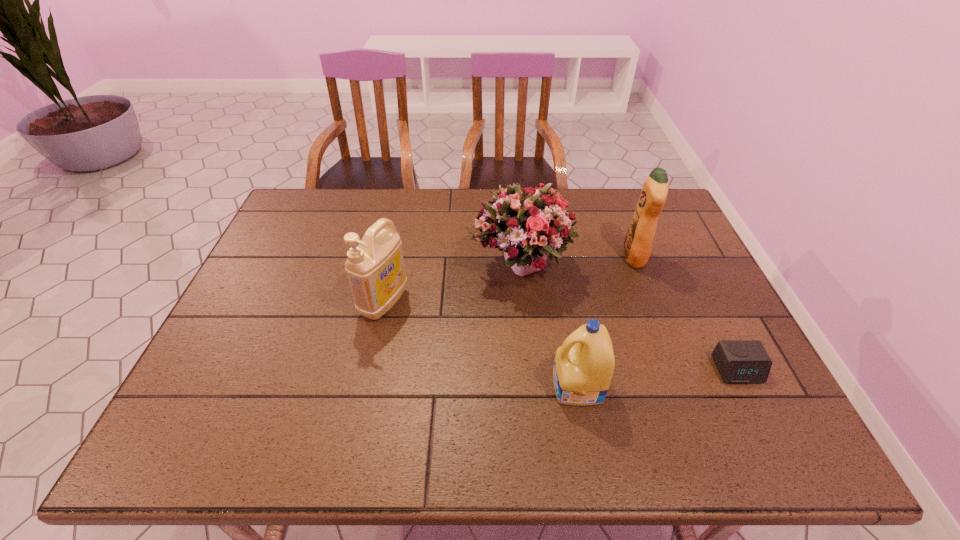
The image size is (960, 540). I want to click on free space between the second farthest detergent and the rightmost detergent, so click(x=509, y=280).

Locate an element on the screen. The image size is (960, 540). free space between the rightmost detergent and the bouquet is located at coordinates point(578,261).

Where is `vacant area that lies between the second nearest detergent and the alarm clock`? This screenshot has height=540, width=960. vacant area that lies between the second nearest detergent and the alarm clock is located at coordinates (561, 336).

This screenshot has height=540, width=960. I want to click on vacant area between the second detergent from right to left and the second object from right to left, so click(x=606, y=321).

Identify the location of unoccupied position between the rightmost object and the shortest detergent. (658, 378).

The width and height of the screenshot is (960, 540). I want to click on object that is the third nearest to the nearest detergent, so click(638, 242).

Where is `object that stands as the fourth closest to the fourth object from left to right`? object that stands as the fourth closest to the fourth object from left to right is located at coordinates (375, 269).

Where is `detergent object that ranks as the third closest to the bouquet`? The height and width of the screenshot is (540, 960). detergent object that ranks as the third closest to the bouquet is located at coordinates (584, 364).

Select which detergent is the second closest to the bouquet. Please provide its 2D coordinates. Your answer should be formatted as a tuple, i.e. [(x, y)], where the tuple contains the x and y coordinates of a point satisfying the conditions above.

[(375, 269)]

Where is `free location that satisfies the following two spatial constraints: 1. on the label of the farthest detergent; 2. on the front side of the bouquet`? free location that satisfies the following two spatial constraints: 1. on the label of the farthest detergent; 2. on the front side of the bouquet is located at coordinates (637, 265).